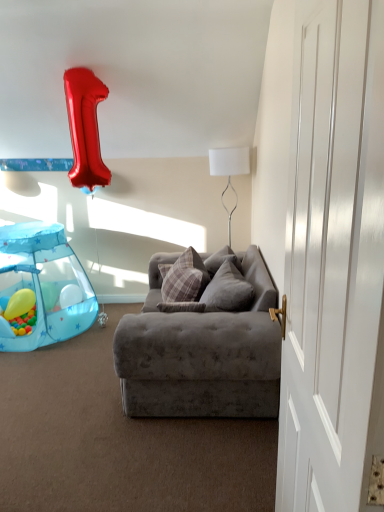
Question: Considering the relative sizes of velvet gray couch at center and white smooth door at right in the image provided, is velvet gray couch at center taller than white smooth door at right?

Choices:
 (A) yes
 (B) no

Answer: (B)

Question: From the image's perspective, would you say velvet gray couch at center is shown under white smooth door at right?

Choices:
 (A) yes
 (B) no

Answer: (A)

Question: Is velvet gray couch at center further to the viewer compared to white smooth door at right?

Choices:
 (A) no
 (B) yes

Answer: (B)

Question: Does velvet gray couch at center have a lesser width compared to white smooth door at right?

Choices:
 (A) no
 (B) yes

Answer: (A)

Question: Is velvet gray couch at center directly adjacent to white smooth door at right?

Choices:
 (A) no
 (B) yes

Answer: (A)

Question: Does velvet gray couch at center appear on the right side of white smooth door at right?

Choices:
 (A) no
 (B) yes

Answer: (A)

Question: Is plaid fabric pillow at center, which appears as the first pillow when viewed from the left, bigger than velvet gray couch at center?

Choices:
 (A) yes
 (B) no

Answer: (B)

Question: Is plaid fabric pillow at center, which is counted as the 2th pillow, starting from the right, not close to velvet gray couch at center?

Choices:
 (A) no
 (B) yes

Answer: (A)

Question: Is plaid fabric pillow at center, which appears as the first pillow when viewed from the left, smaller than velvet gray couch at center?

Choices:
 (A) yes
 (B) no

Answer: (A)

Question: Is plaid fabric pillow at center, which is counted as the 2th pillow, starting from the right, wider than velvet gray couch at center?

Choices:
 (A) yes
 (B) no

Answer: (B)

Question: Can you confirm if plaid fabric pillow at center, which appears as the first pillow when viewed from the left, is positioned to the left of velvet gray couch at center?

Choices:
 (A) yes
 (B) no

Answer: (A)

Question: From the image's perspective, is plaid fabric pillow at center, which is counted as the 2th pillow, starting from the right, on top of velvet gray couch at center?

Choices:
 (A) no
 (B) yes

Answer: (B)

Question: Does plaid fabric pillow at center, which appears as the first pillow when viewed from the left, have a smaller size compared to white smooth door at right?

Choices:
 (A) yes
 (B) no

Answer: (A)